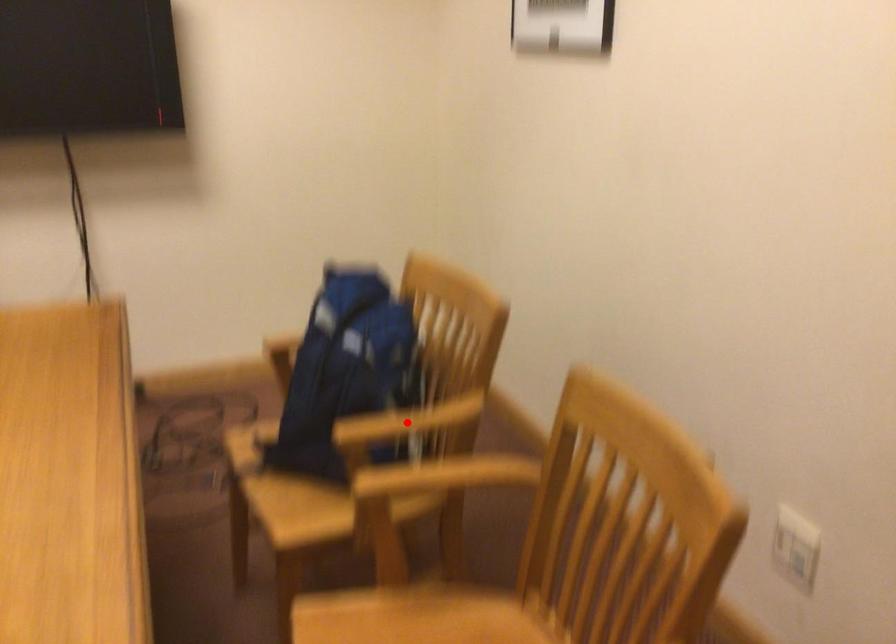
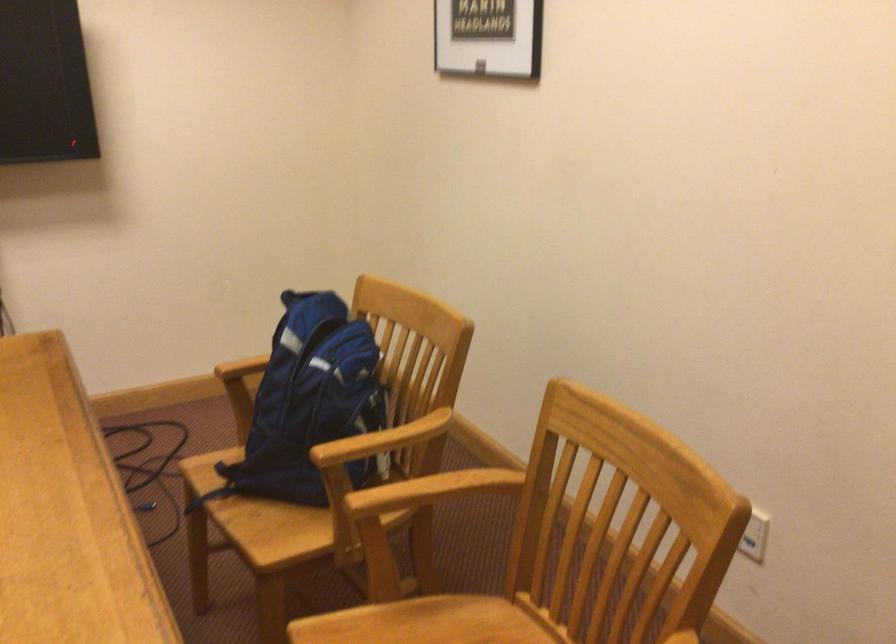
Find the pixel in the second image that matches the highlighted location in the first image.

(383, 440)